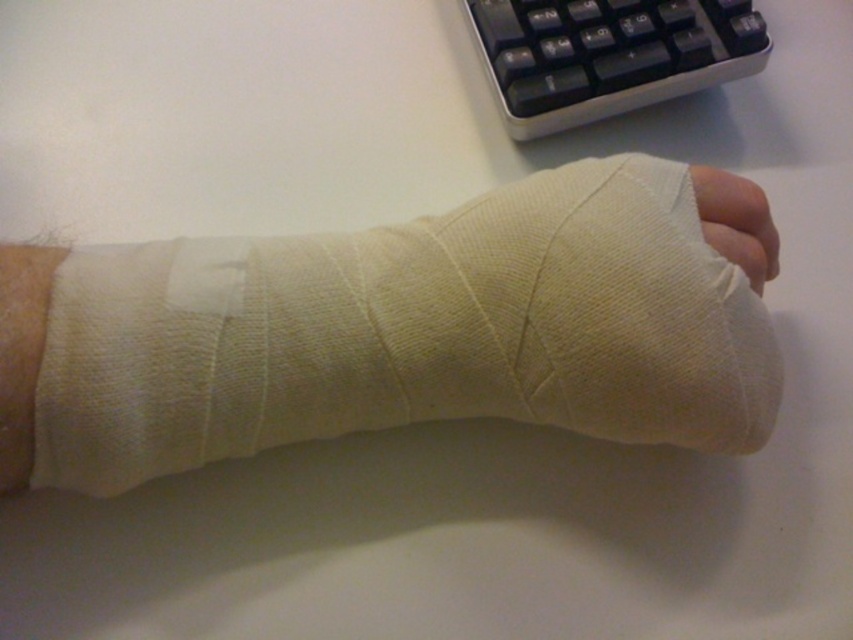
Question: Among these points, which one is nearest to the camera?

Choices:
 (A) (601, 113)
 (B) (88, 488)

Answer: (B)

Question: Among these objects, which one is farthest from the camera?

Choices:
 (A) black plastic keyboard at upper right
 (B) white fabric bandage at center

Answer: (A)

Question: Which of the following is the farthest from the observer?

Choices:
 (A) (724, 172)
 (B) (610, 44)

Answer: (B)

Question: Considering the relative positions of black plastic keyboard at upper right and white fabric bandage at center in the image provided, where is black plastic keyboard at upper right located with respect to white fabric bandage at center?

Choices:
 (A) below
 (B) above

Answer: (B)

Question: Is the position of white cloth bandage at center more distant than that of white fabric bandage at center?

Choices:
 (A) no
 (B) yes

Answer: (A)

Question: Does white cloth bandage at center come behind black plastic keyboard at upper right?

Choices:
 (A) no
 (B) yes

Answer: (A)